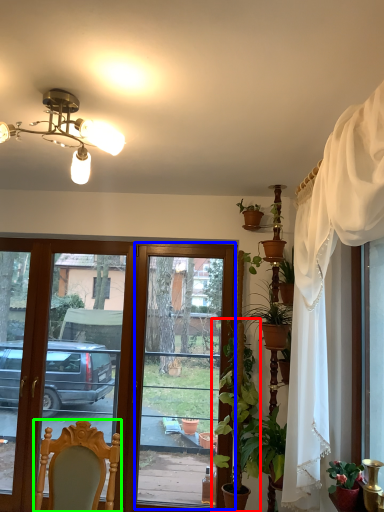
Question: Which object is the farthest from houseplant (highlighted by a red box)? Choose among these: window screen (highlighted by a blue box) or chair (highlighted by a green box).

Choices:
 (A) window screen
 (B) chair

Answer: (A)